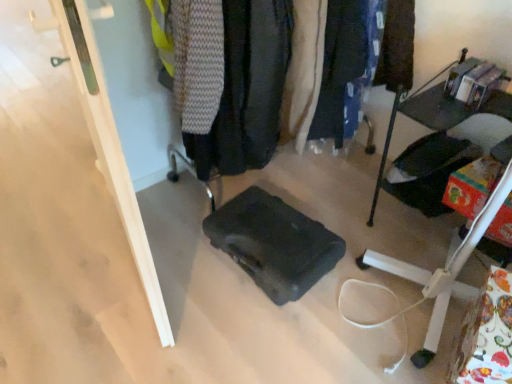
Question: In terms of height, does metallic black shelf at right look taller or shorter compared to dark gray fabric jacket at center, placed as the second clothing when sorted from right to left?

Choices:
 (A) short
 (B) tall

Answer: (A)

Question: Based on their sizes in the image, would you say metallic black shelf at right is bigger or smaller than dark gray fabric jacket at center, placed as the second clothing when sorted from right to left?

Choices:
 (A) small
 (B) big

Answer: (B)

Question: Which of these objects is positioned closest to the black matte suitcase at center?

Choices:
 (A) dark gray fabric jacket at center, which appears as the 1th clothing when viewed from the left
 (B) metallic black shelf at right
 (C) dark blue fabric pants at center, positioned as the 2th clothing in left-to-right order
 (D) dark gray fabric at center

Answer: (A)

Question: Based on their relative distances, which object is farther from the metallic black shelf at right?

Choices:
 (A) dark gray fabric jacket at center, placed as the second clothing when sorted from right to left
 (B) dark blue fabric pants at center, which is the 1th clothing from right to left
 (C) dark gray fabric at center
 (D) black matte suitcase at center

Answer: (A)